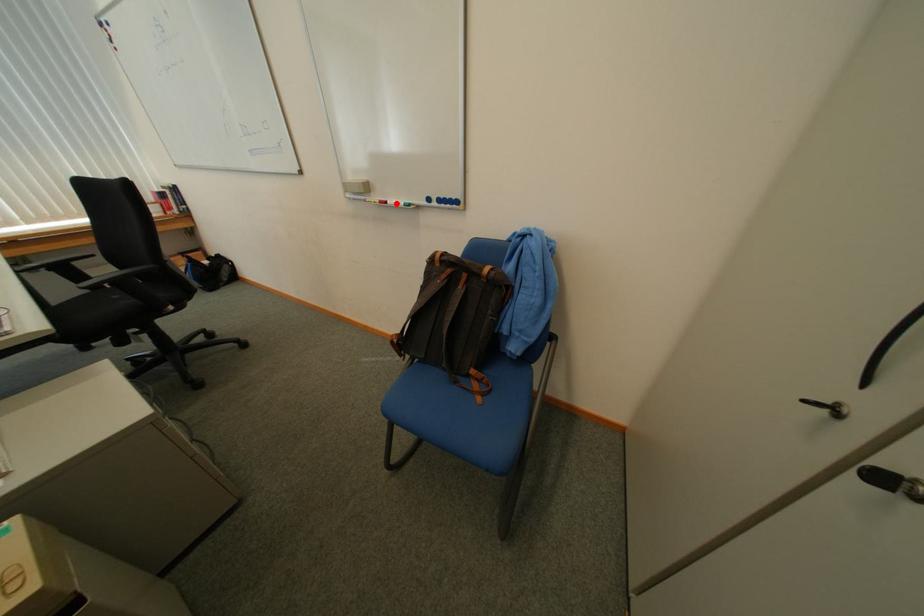
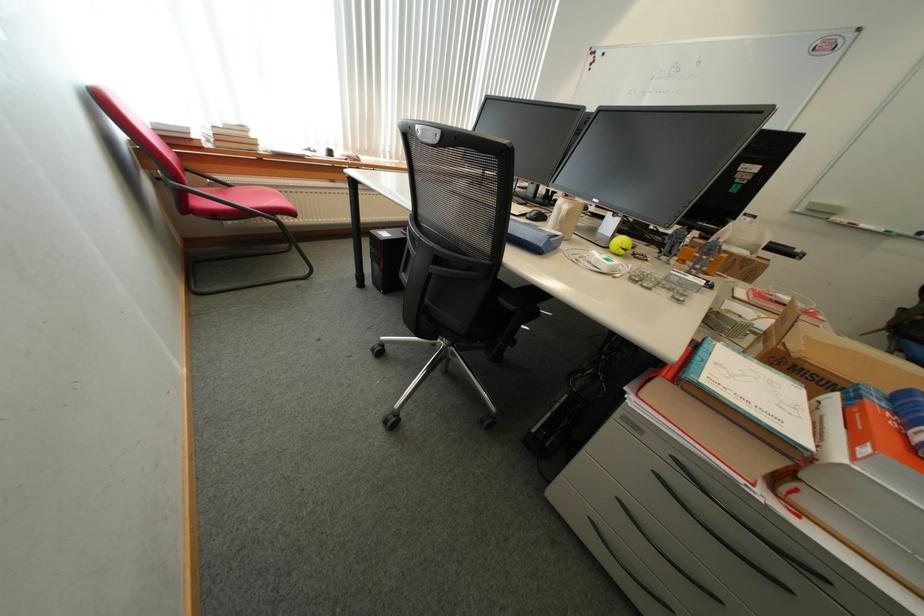
Where in the second image is the point corresponding to the highlighted location from the first image?

(861, 225)